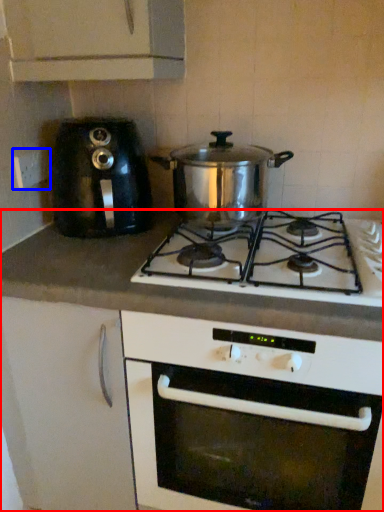
Question: Which point is closer to the camera, counter (highlighted by a red box) or electric outlet (highlighted by a blue box)?

Choices:
 (A) counter
 (B) electric outlet

Answer: (A)